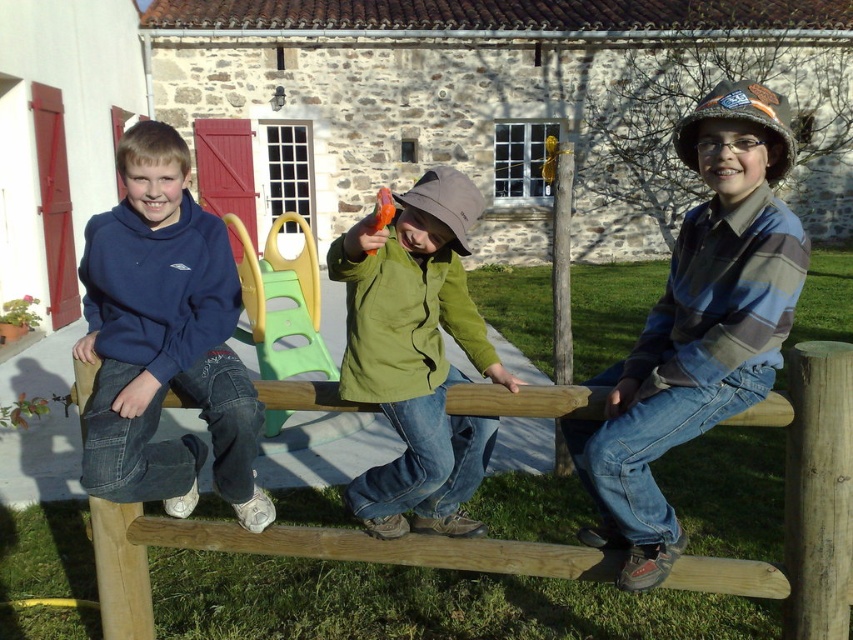
Question: Estimate the real-world distances between objects in this image. Which object is farther from the matte blue hoodie at left?

Choices:
 (A) striped flannel shirt at right
 (B) green plastic slide at center

Answer: (B)

Question: Observing the image, what is the correct spatial positioning of wooden at center in reference to green matte jacket at center?

Choices:
 (A) above
 (B) below

Answer: (B)

Question: Does wooden at center have a smaller size compared to green plastic slide at center?

Choices:
 (A) yes
 (B) no

Answer: (A)

Question: Among these points, which one is nearest to the camera?

Choices:
 (A) (173, 349)
 (B) (473, 522)
 (C) (587, 529)

Answer: (A)

Question: Which object is positioned farthest from the matte blue hoodie at left?

Choices:
 (A) green plastic slide at center
 (B) striped flannel shirt at right

Answer: (A)

Question: Is striped flannel shirt at right to the left of wooden at center from the viewer's perspective?

Choices:
 (A) yes
 (B) no

Answer: (B)